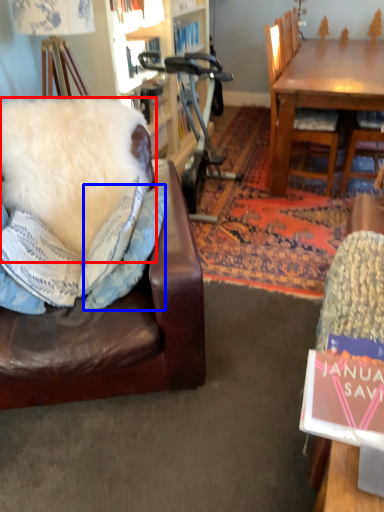
Question: Which object is closer to the camera taking this photo, pillow (highlighted by a red box) or pillow (highlighted by a blue box)?

Choices:
 (A) pillow
 (B) pillow

Answer: (B)